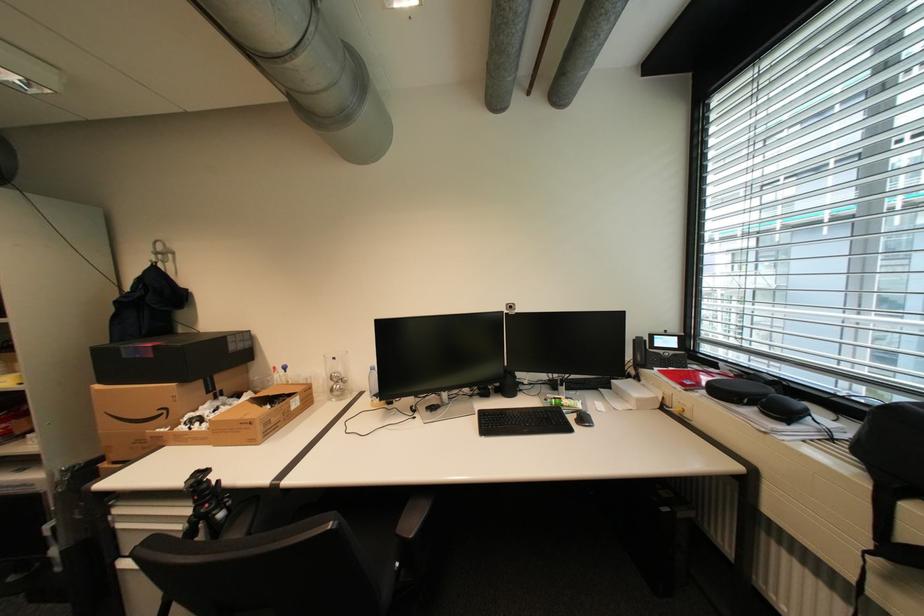
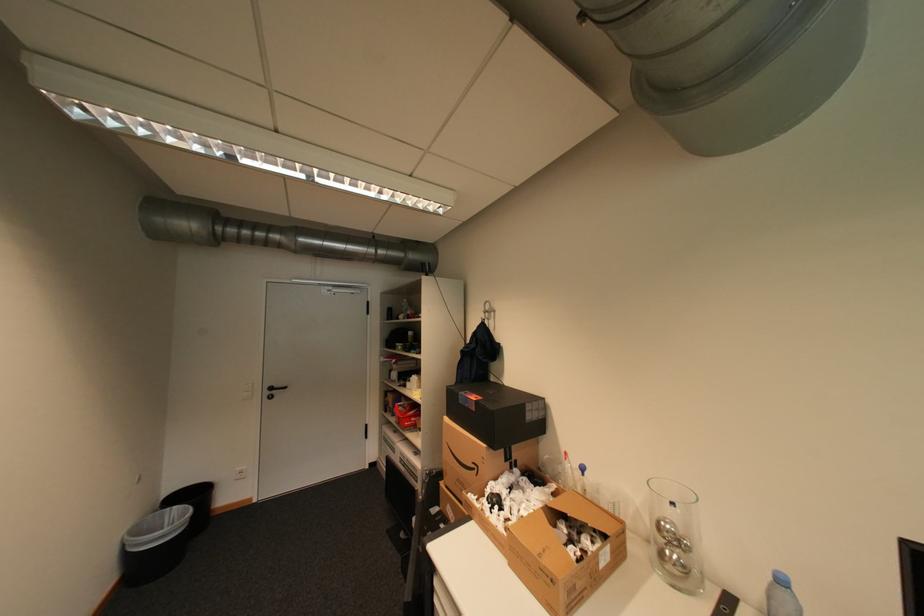
Where in the second image is the point corresponding to point 174,411 from the first image?

(484, 468)